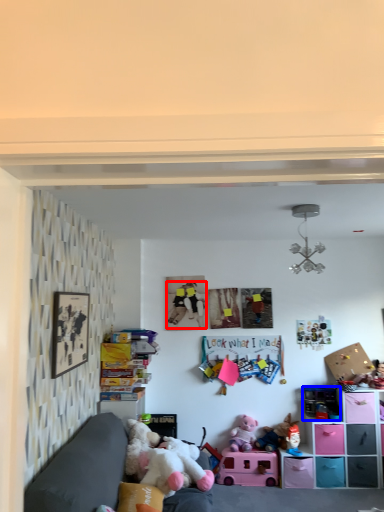
Question: Which point is further to the camera, person (highlighted by a red box) or toy (highlighted by a blue box)?

Choices:
 (A) person
 (B) toy

Answer: (A)